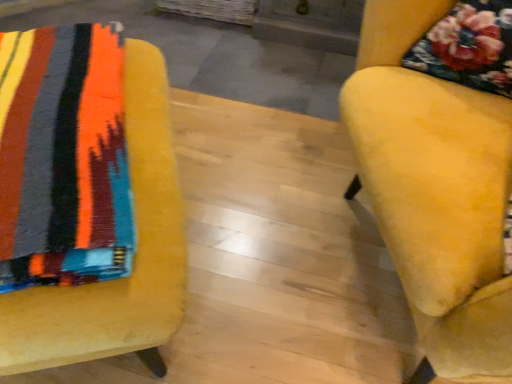
Question: Considering the relative sizes of velvet yellow chair at right, the second chair when ordered from left to right, and velvet yellow chair at left, which ranks as the first chair in left-to-right order, in the image provided, is velvet yellow chair at right, the second chair when ordered from left to right, taller than velvet yellow chair at left, which ranks as the first chair in left-to-right order,?

Choices:
 (A) yes
 (B) no

Answer: (A)

Question: Does velvet yellow chair at right, which is the 1th chair in right-to-left order, contain velvet yellow chair at left, which ranks as the first chair in left-to-right order?

Choices:
 (A) no
 (B) yes

Answer: (A)

Question: Is velvet yellow chair at right, the second chair when ordered from left to right, at the left side of velvet yellow chair at left, which ranks as the first chair in left-to-right order?

Choices:
 (A) no
 (B) yes

Answer: (A)

Question: From the image's perspective, would you say velvet yellow chair at right, the second chair when ordered from left to right, is positioned over velvet yellow chair at left, which ranks as the first chair in left-to-right order?

Choices:
 (A) no
 (B) yes

Answer: (B)

Question: From the image's perspective, does velvet yellow chair at right, the second chair when ordered from left to right, appear lower than velvet yellow chair at left, which is the second chair in right-to-left order?

Choices:
 (A) yes
 (B) no

Answer: (B)

Question: Is velvet yellow chair at right, which is the 1th chair in right-to-left order, shorter than velvet yellow chair at left, which ranks as the first chair in left-to-right order?

Choices:
 (A) no
 (B) yes

Answer: (A)

Question: Is velvet yellow chair at left, which is the second chair in right-to-left order, at the left side of velvet yellow chair at right, the second chair when ordered from left to right?

Choices:
 (A) yes
 (B) no

Answer: (A)

Question: Considering the relative sizes of velvet yellow chair at left, which is the second chair in right-to-left order, and velvet yellow chair at right, which is the 1th chair in right-to-left order, in the image provided, is velvet yellow chair at left, which is the second chair in right-to-left order, smaller than velvet yellow chair at right, which is the 1th chair in right-to-left order,?

Choices:
 (A) no
 (B) yes

Answer: (B)

Question: Considering the relative positions of velvet yellow chair at left, which is the second chair in right-to-left order, and velvet yellow chair at right, the second chair when ordered from left to right, in the image provided, is velvet yellow chair at left, which is the second chair in right-to-left order, to the right of velvet yellow chair at right, the second chair when ordered from left to right, from the viewer's perspective?

Choices:
 (A) yes
 (B) no

Answer: (B)

Question: Is there a large distance between velvet yellow chair at left, which is the second chair in right-to-left order, and velvet yellow chair at right, the second chair when ordered from left to right?

Choices:
 (A) no
 (B) yes

Answer: (A)

Question: Is velvet yellow chair at left, which ranks as the first chair in left-to-right order, with velvet yellow chair at right, the second chair when ordered from left to right?

Choices:
 (A) no
 (B) yes

Answer: (A)

Question: From a real-world perspective, is velvet yellow chair at left, which ranks as the first chair in left-to-right order, below velvet yellow chair at right, which is the 1th chair in right-to-left order?

Choices:
 (A) yes
 (B) no

Answer: (A)

Question: Is velvet yellow chair at right, which is the 1th chair in right-to-left order, spatially inside velvet yellow chair at left, which ranks as the first chair in left-to-right order, or outside of it?

Choices:
 (A) inside
 (B) outside

Answer: (B)